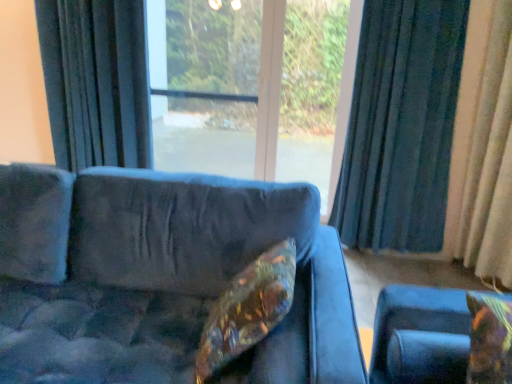
Locate an element on the screen. dark blue fabric curtain at right, which is the second curtain in right-to-left order is located at coordinates (401, 126).

What do you see at coordinates (247, 309) in the screenshot?
I see `shiny metallic pillow at center, which ranks as the second pillow in right-to-left order` at bounding box center [247, 309].

Image resolution: width=512 pixels, height=384 pixels. In order to click on shiny metallic pillow at center, the first pillow viewed from the left in this screenshot , I will do `click(247, 309)`.

This screenshot has width=512, height=384. I want to click on velvet-like floral pillow at lower right, arranged as the 1th pillow when viewed from the right, so tap(490, 340).

Describe the element at coordinates (483, 148) in the screenshot. I see `beige fabric curtain at right, the 3th curtain when ordered from left to right` at that location.

The height and width of the screenshot is (384, 512). Describe the element at coordinates (159, 277) in the screenshot. I see `velvet blue couch at center` at that location.

Where is `dark blue fabric curtain at right, which is the second curtain in right-to-left order`? The height and width of the screenshot is (384, 512). dark blue fabric curtain at right, which is the second curtain in right-to-left order is located at coordinates (401, 126).

The width and height of the screenshot is (512, 384). Identify the location of the 1st pillow below when counting from the dark blue fabric curtain at right, which is the second curtain in right-to-left order (from the image's perspective). (247, 309).

In the scene shown: Who is shorter, shiny metallic pillow at center, the first pillow viewed from the left, or dark blue fabric curtain at right, which is the second curtain in right-to-left order?

Standing shorter between the two is shiny metallic pillow at center, the first pillow viewed from the left.

Does shiny metallic pillow at center, which ranks as the second pillow in right-to-left order, turn towards dark blue fabric curtain at right, the second curtain viewed from the left?

No, shiny metallic pillow at center, which ranks as the second pillow in right-to-left order, is not facing towards dark blue fabric curtain at right, the second curtain viewed from the left.

Is shiny metallic pillow at center, the first pillow viewed from the left, at the right side of dark blue fabric curtain at left, the 3th curtain positioned from the right?

Yes, shiny metallic pillow at center, the first pillow viewed from the left, is to the right of dark blue fabric curtain at left, the 3th curtain positioned from the right.

Is shiny metallic pillow at center, the first pillow viewed from the left, inside or outside of dark blue fabric curtain at left, which is counted as the 1th curtain, starting from the left?

The correct answer is: outside.

Considering the sizes of shiny metallic pillow at center, which ranks as the second pillow in right-to-left order, and dark blue fabric curtain at left, the 3th curtain positioned from the right, in the image, is shiny metallic pillow at center, which ranks as the second pillow in right-to-left order, bigger or smaller than dark blue fabric curtain at left, the 3th curtain positioned from the right,?

Considering their sizes, shiny metallic pillow at center, which ranks as the second pillow in right-to-left order, takes up less space than dark blue fabric curtain at left, the 3th curtain positioned from the right.

From the image's perspective, is shiny metallic pillow at center, the first pillow viewed from the left, on top of dark blue fabric curtain at left, the 3th curtain positioned from the right?

No, from the image's perspective, shiny metallic pillow at center, the first pillow viewed from the left, is not over dark blue fabric curtain at left, the 3th curtain positioned from the right.

Is shiny metallic pillow at center, the first pillow viewed from the left, oriented away from velvet-like floral pillow at lower right, which is the 2th pillow from left to right?

Yes, shiny metallic pillow at center, the first pillow viewed from the left, is facing away from velvet-like floral pillow at lower right, which is the 2th pillow from left to right.

Can you see shiny metallic pillow at center, the first pillow viewed from the left, touching velvet-like floral pillow at lower right, arranged as the 1th pillow when viewed from the right?

shiny metallic pillow at center, the first pillow viewed from the left, is not next to velvet-like floral pillow at lower right, arranged as the 1th pillow when viewed from the right, and they're not touching.

How much distance is there between shiny metallic pillow at center, which ranks as the second pillow in right-to-left order, and velvet-like floral pillow at lower right, arranged as the 1th pillow when viewed from the right?

57.71 centimeters.

Which is closer, (241, 308) or (318, 340)?

Point (241, 308) appears to be farther away from the viewer than point (318, 340).

Which object is closer to the camera taking this photo, shiny metallic pillow at center, the first pillow viewed from the left, or velvet blue couch at center?

Positioned in front is velvet blue couch at center.

Considering the sizes of shiny metallic pillow at center, the first pillow viewed from the left, and velvet blue couch at center in the image, is shiny metallic pillow at center, the first pillow viewed from the left, wider or thinner than velvet blue couch at center?

In the image, shiny metallic pillow at center, the first pillow viewed from the left, appears to be more narrow than velvet blue couch at center.

From a real-world perspective, is shiny metallic pillow at center, which ranks as the second pillow in right-to-left order, above or below velvet blue couch at center?

In terms of real-world spatial position, shiny metallic pillow at center, which ranks as the second pillow in right-to-left order, is above velvet blue couch at center.

Locate an element on the screen. The image size is (512, 384). studio couch located on the left of velvet-like floral pillow at lower right, arranged as the 1th pillow when viewed from the right is located at coordinates (159, 277).

Consider the image. Between velvet blue couch at center and velvet-like floral pillow at lower right, which is the 2th pillow from left to right, which one has larger width?

velvet blue couch at center.

Is velvet blue couch at center in contact with velvet-like floral pillow at lower right, which is the 2th pillow from left to right?

No.

Which is more to the left, velvet blue couch at center or velvet-like floral pillow at lower right, which is the 2th pillow from left to right?

velvet blue couch at center.

Does dark blue fabric curtain at left, which is counted as the 1th curtain, starting from the left, have a smaller size compared to beige fabric curtain at right, which is the first curtain from right to left?

No.

Is dark blue fabric curtain at left, the 3th curtain positioned from the right, outside of beige fabric curtain at right, which is the first curtain from right to left?

Yes, dark blue fabric curtain at left, the 3th curtain positioned from the right, is outside of beige fabric curtain at right, which is the first curtain from right to left.

Identify the location of curtain that is the 2nd object located below the dark blue fabric curtain at left, which is counted as the 1th curtain, starting from the left (from the image's perspective). (483, 148).

Is dark blue fabric curtain at right, the second curtain viewed from the left, not within transparent glass screen door at center?

Yes.

From a real-world perspective, is dark blue fabric curtain at right, which is the second curtain in right-to-left order, positioned above or below transparent glass screen door at center?

Clearly, from a real-world perspective, dark blue fabric curtain at right, which is the second curtain in right-to-left order, is below transparent glass screen door at center.

Does point (372, 26) lie in front of point (163, 152)?

Yes.

Between dark blue fabric curtain at right, the second curtain viewed from the left, and transparent glass screen door at center, which one appears on the left side from the viewer's perspective?

Positioned to the left is transparent glass screen door at center.

Locate an element on the screen. The width and height of the screenshot is (512, 384). the 2nd pillow to the left when counting from the dark blue fabric curtain at right, which is the second curtain in right-to-left order is located at coordinates (247, 309).

From the image's perspective, count 1st pillows downward from the dark blue fabric curtain at left, which is counted as the 1th curtain, starting from the left, and point to it. Please provide its 2D coordinates.

[(247, 309)]

When comparing their distances from velvet-like floral pillow at lower right, arranged as the 1th pillow when viewed from the right, does dark blue fabric curtain at right, which is the second curtain in right-to-left order, or velvet blue couch at center seem further?

The object further to velvet-like floral pillow at lower right, arranged as the 1th pillow when viewed from the right, is dark blue fabric curtain at right, which is the second curtain in right-to-left order.

Based on their spatial positions, is velvet-like floral pillow at lower right, which is the 2th pillow from left to right, or shiny metallic pillow at center, the first pillow viewed from the left, further from dark blue fabric curtain at right, the second curtain viewed from the left?

velvet-like floral pillow at lower right, which is the 2th pillow from left to right, lies further to dark blue fabric curtain at right, the second curtain viewed from the left, than the other object.

Which object lies nearer to the anchor point dark blue fabric curtain at right, the second curtain viewed from the left, velvet-like floral pillow at lower right, arranged as the 1th pillow when viewed from the right, or transparent glass screen door at center?

Based on the image, transparent glass screen door at center appears to be nearer to dark blue fabric curtain at right, the second curtain viewed from the left.

From the picture: When comparing their distances from beige fabric curtain at right, the 3th curtain when ordered from left to right, does transparent glass screen door at center or velvet-like floral pillow at lower right, which is the 2th pillow from left to right, seem closer?

velvet-like floral pillow at lower right, which is the 2th pillow from left to right, is positioned closer to the anchor beige fabric curtain at right, the 3th curtain when ordered from left to right.

Estimate the real-world distances between objects in this image. Which object is closer to dark blue fabric curtain at left, which is counted as the 1th curtain, starting from the left, dark blue fabric curtain at right, the second curtain viewed from the left, or shiny metallic pillow at center, the first pillow viewed from the left?

dark blue fabric curtain at right, the second curtain viewed from the left, is closer to dark blue fabric curtain at left, which is counted as the 1th curtain, starting from the left.

When comparing their distances from velvet blue couch at center, does beige fabric curtain at right, which is the first curtain from right to left, or velvet-like floral pillow at lower right, which is the 2th pillow from left to right, seem closer?

velvet-like floral pillow at lower right, which is the 2th pillow from left to right.

Estimate the real-world distances between objects in this image. Which object is closer to shiny metallic pillow at center, the first pillow viewed from the left, velvet-like floral pillow at lower right, arranged as the 1th pillow when viewed from the right, or velvet blue couch at center?

Based on the image, velvet blue couch at center appears to be nearer to shiny metallic pillow at center, the first pillow viewed from the left.

Based on the photo, from the image, which object appears to be nearer to transparent glass screen door at center, shiny metallic pillow at center, the first pillow viewed from the left, or velvet-like floral pillow at lower right, which is the 2th pillow from left to right?

shiny metallic pillow at center, the first pillow viewed from the left, is positioned closer to the anchor transparent glass screen door at center.

I want to click on pillow between velvet-like floral pillow at lower right, which is the 2th pillow from left to right, and dark blue fabric curtain at right, which is the second curtain in right-to-left order, in the front-back direction, so click(247, 309).

Find the location of a particular element. Image resolution: width=512 pixels, height=384 pixels. curtain between velvet blue couch at center and beige fabric curtain at right, which is the first curtain from right to left, from left to right is located at coordinates (401, 126).

The width and height of the screenshot is (512, 384). Find the location of `curtain between transparent glass screen door at center and beige fabric curtain at right, which is the first curtain from right to left, in the horizontal direction`. curtain between transparent glass screen door at center and beige fabric curtain at right, which is the first curtain from right to left, in the horizontal direction is located at coordinates pyautogui.click(x=401, y=126).

This screenshot has width=512, height=384. What are the coordinates of `pillow between velvet-like floral pillow at lower right, which is the 2th pillow from left to right, and dark blue fabric curtain at left, the 3th curtain positioned from the right, along the z-axis` in the screenshot? It's located at (247, 309).